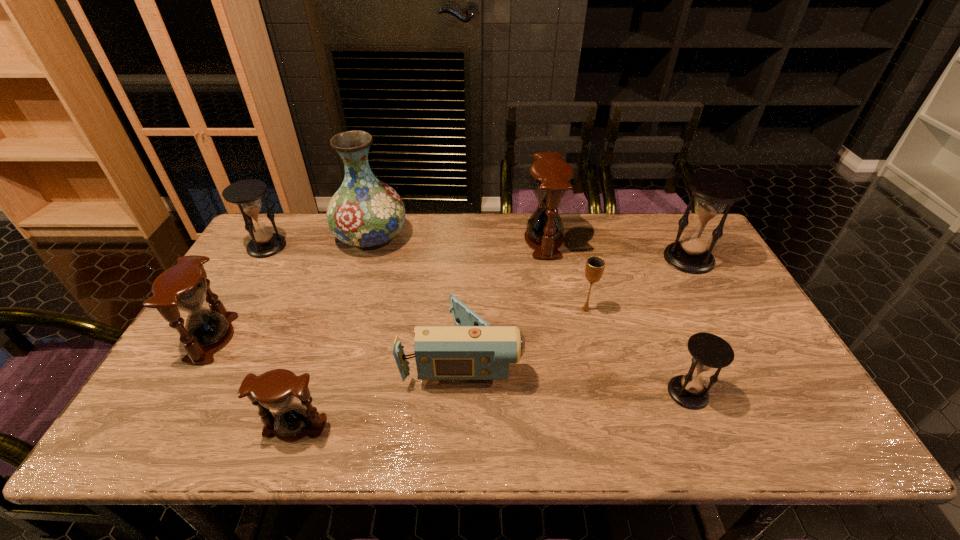
You are a GUI agent. You are given a task and a screenshot of the screen. Output one action in this format:
    pyautogui.click(x=<x>, y=<y>)
    Task: Click on the free space that is in between the camcorder and the nearest black hourglass
    This screenshot has height=540, width=960.
    Given the screenshot: What is the action you would take?
    pyautogui.click(x=575, y=372)

At what (x,y) coordinates should I click in order to perform the action: click on vacant area that lies between the fourth farthest hourglass and the blue vase. Please return your answer as a coordinate pair (x, y). The width and height of the screenshot is (960, 540). Looking at the image, I should click on (292, 288).

Point out which object is positioned as the second nearest to the farthest brown hourglass. Please provide its 2D coordinates. Your answer should be formatted as a tuple, i.e. [(x, y)], where the tuple contains the x and y coordinates of a point satisfying the conditions above.

[(473, 350)]

Locate an element on the screen. object that stands as the seventh closest to the second farthest brown hourglass is located at coordinates (709, 351).

Find the location of a particular element. hourglass that stands as the second closest to the nearest black hourglass is located at coordinates (550, 179).

This screenshot has height=540, width=960. I want to click on hourglass that stands as the third closest to the chalice, so click(714, 190).

Image resolution: width=960 pixels, height=540 pixels. I want to click on brown hourglass that is the second nearest to the smallest brown hourglass, so [550, 179].

At what (x,y) coordinates should I click in order to perform the action: click on the closest brown hourglass to the third hourglass from left to right. Please return your answer as a coordinate pair (x, y). This screenshot has height=540, width=960. Looking at the image, I should click on (183, 287).

Choose which black hourglass is the nearest neighbor to the second object from right to left. Please provide its 2D coordinates. Your answer should be formatted as a tuple, i.e. [(x, y)], where the tuple contains the x and y coordinates of a point satisfying the conditions above.

[(714, 190)]

Point out which black hourglass is positioned as the nearest to the leftmost black hourglass. Please provide its 2D coordinates. Your answer should be formatted as a tuple, i.e. [(x, y)], where the tuple contains the x and y coordinates of a point satisfying the conditions above.

[(709, 351)]